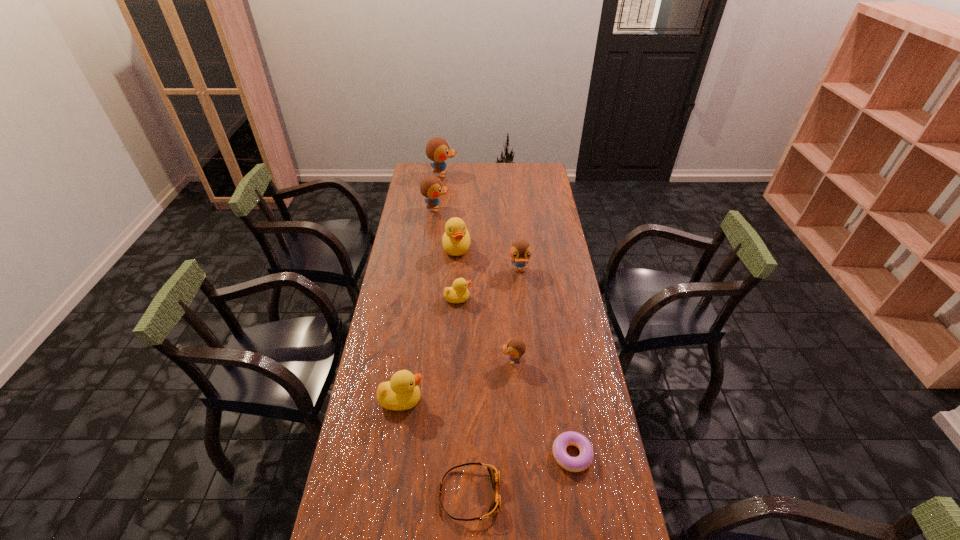
At what (x,y) coordinates should I click in order to perform the action: click on the biggest blue duck. Please return your answer as a coordinate pair (x, y). Looking at the image, I should click on (437, 149).

Image resolution: width=960 pixels, height=540 pixels. I want to click on the tallest object, so click(437, 149).

Locate an element on the screen. This screenshot has width=960, height=540. the eighth nearest object is located at coordinates 431,187.

Locate an element on the screen. the second farthest duck is located at coordinates (431, 187).

I want to click on the biggest yellow duck, so click(456, 240).

This screenshot has width=960, height=540. Find the location of `the third farthest duck`. the third farthest duck is located at coordinates (456, 240).

Identify the location of the sixth nearest object. Image resolution: width=960 pixels, height=540 pixels. (520, 251).

Locate an element on the screen. the third farthest blue duck is located at coordinates (x=520, y=251).

At what (x,y) coordinates should I click in order to perform the action: click on the leftmost yellow duck. Please return your answer as a coordinate pair (x, y). This screenshot has width=960, height=540. Looking at the image, I should click on (402, 392).

I want to click on the second biggest yellow duck, so click(402, 392).